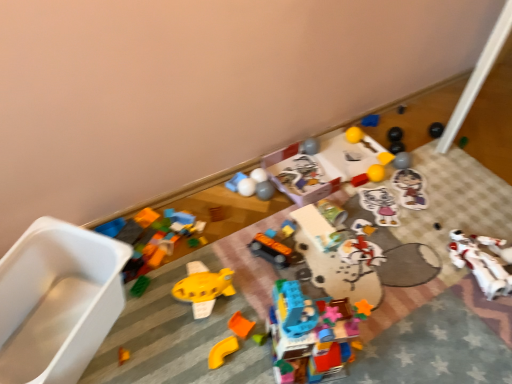
You are a GUI agent. You are given a task and a screenshot of the screen. Output one action in this format:
    pyautogui.click(x=<x>, y=<y>)
    Task: Click on the free space between white plastic container at left, the seventeenth toy when ordered from right to left, and orange matte block at center, which is the thirteenth toy from right to left
    
    Given the screenshot: What is the action you would take?
    pyautogui.click(x=164, y=342)